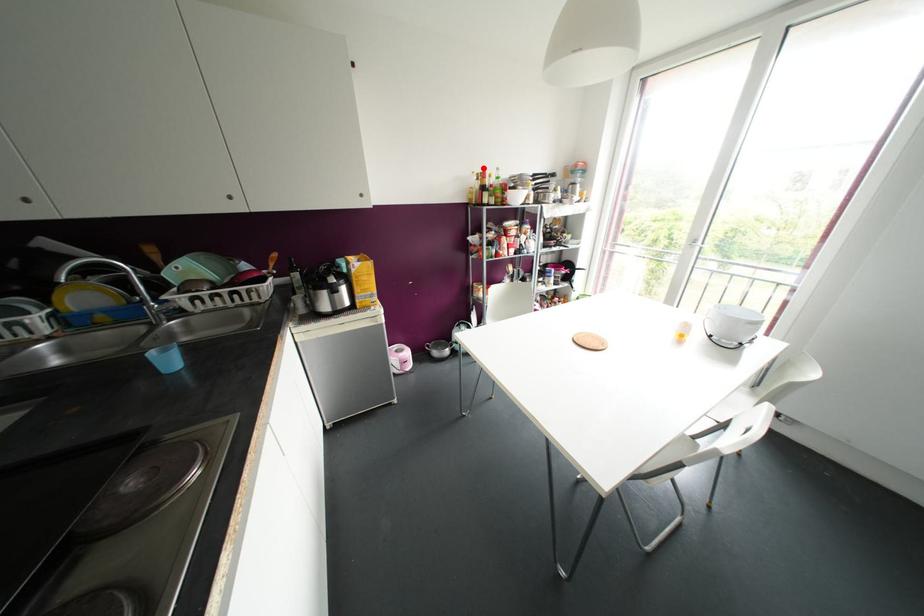
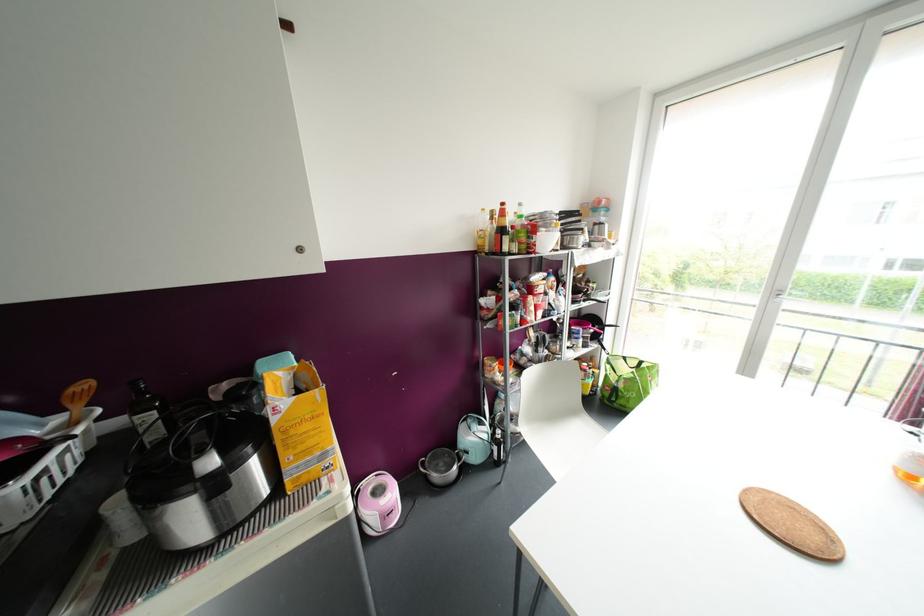
Where in the second image is the point corresponding to the highlighted location from the first image?

(502, 204)